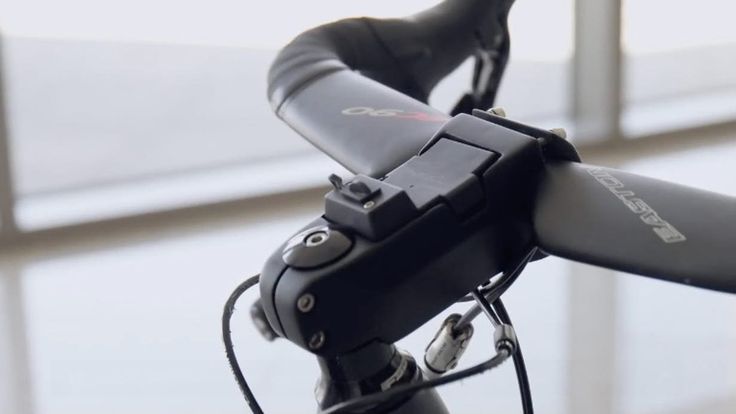
The width and height of the screenshot is (736, 414). In order to click on window in this screenshot , I will do `click(171, 109)`.